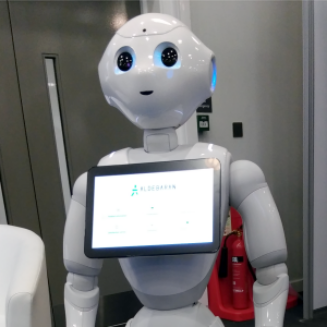
Where is `grey door`? grey door is located at coordinates (41, 125).